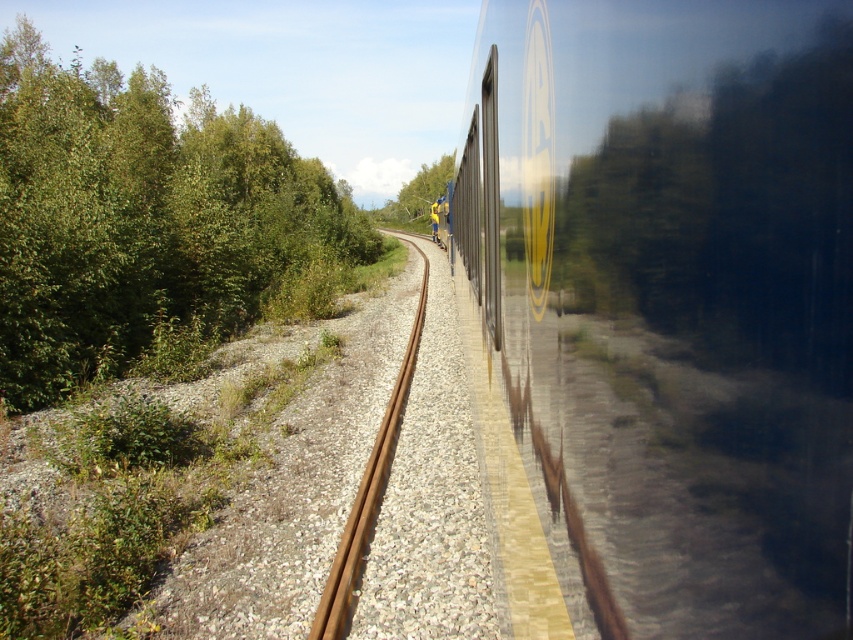
Looking at this image, who is more distant from viewer, (582,604) or (263,256)?

Positioned behind is point (263,256).

Is metallic silver train at right to the left of green leafy trees at left from the viewer's perspective?

In fact, metallic silver train at right is to the right of green leafy trees at left.

Between point (784, 67) and point (22, 60), which one is positioned behind?

Point (22, 60)

Find the location of a particular element. metallic silver train at right is located at coordinates (675, 301).

Does metallic silver train at right appear on the left side of rusty metal train track at center?

In fact, metallic silver train at right is to the right of rusty metal train track at center.

Is metallic silver train at right to the right of rusty metal train track at center from the viewer's perspective?

Yes, metallic silver train at right is to the right of rusty metal train track at center.

Identify the location of metallic silver train at right. This screenshot has height=640, width=853. (675, 301).

This screenshot has height=640, width=853. In order to click on metallic silver train at right in this screenshot , I will do `click(675, 301)`.

Who is taller, green leafy trees at left or rusty metal train track at center?

With more height is green leafy trees at left.

Which is more to the left, green leafy trees at left or rusty metal train track at center?

Positioned to the left is green leafy trees at left.

Does point (126, 337) come in front of point (387, 417)?

No, (126, 337) is further to viewer.

Locate an element on the screen. This screenshot has width=853, height=640. green leafy trees at left is located at coordinates (138, 218).